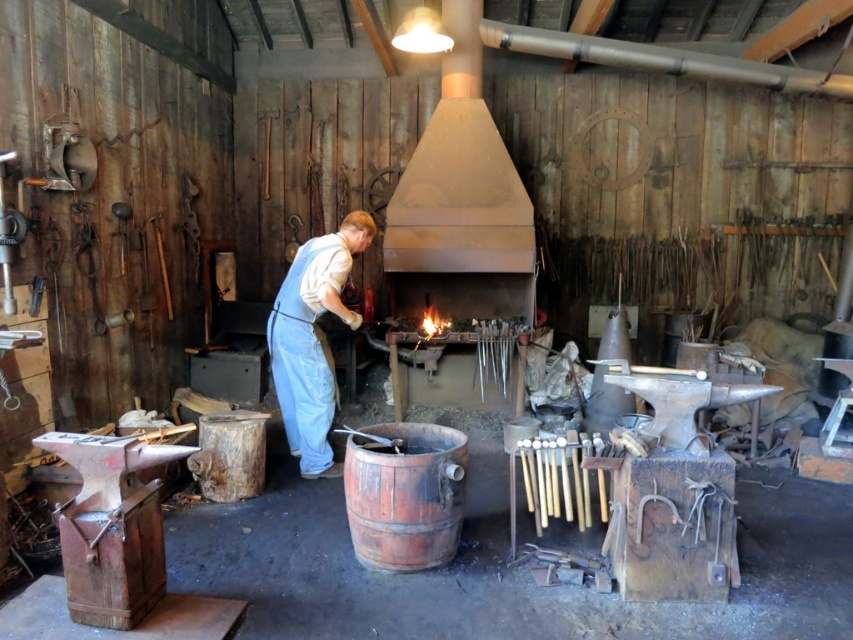
Who is taller, rustic wooden barrel at center or denim overalls at center?

With more height is denim overalls at center.

Can you confirm if rustic wooden barrel at center is shorter than denim overalls at center?

Correct, rustic wooden barrel at center is not as tall as denim overalls at center.

Who is more forward, (415, 496) or (271, 372)?

Point (415, 496) is more forward.

This screenshot has width=853, height=640. What are the coordinates of `rustic wooden barrel at center` in the screenshot? It's located at (405, 493).